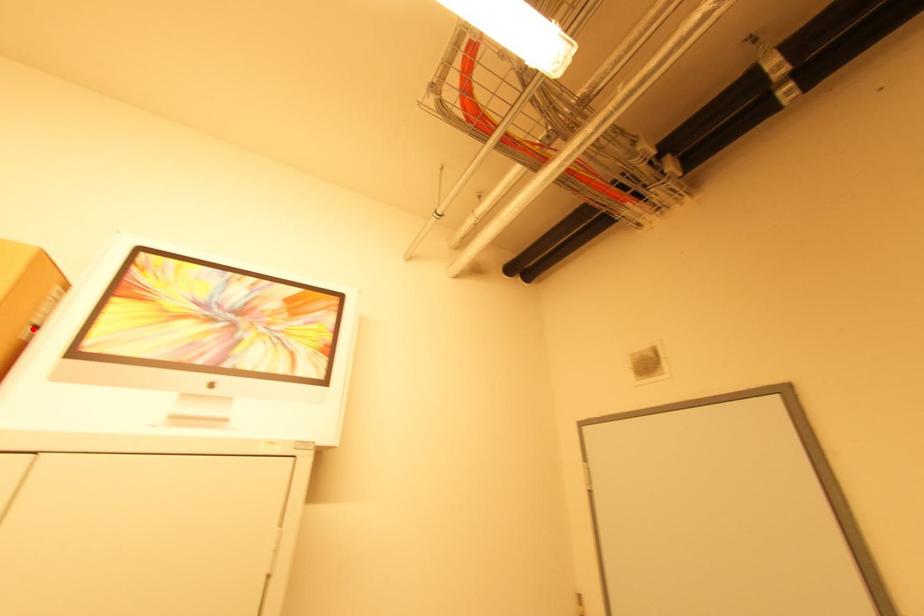
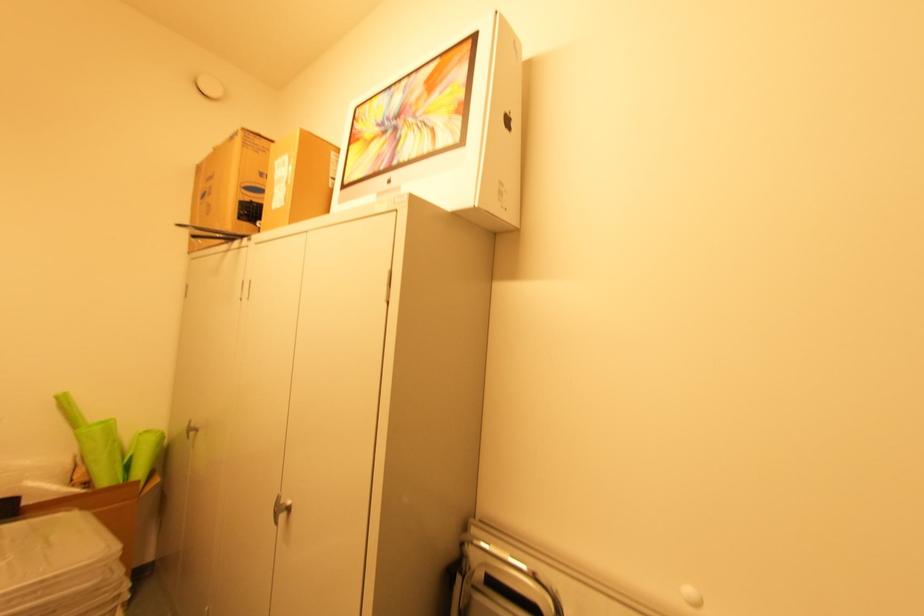
The point at the highlighted location is marked in the first image. Where is the corresponding point in the second image?

(334, 180)